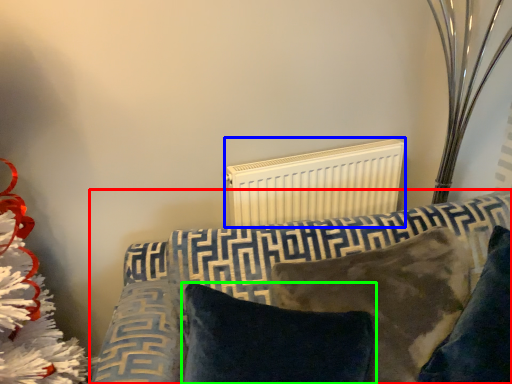
Question: Which object is positioned closest to furniture (highlighted by a red box)? Select from radiator (highlighted by a blue box) and pillow (highlighted by a green box).

Choices:
 (A) radiator
 (B) pillow

Answer: (B)